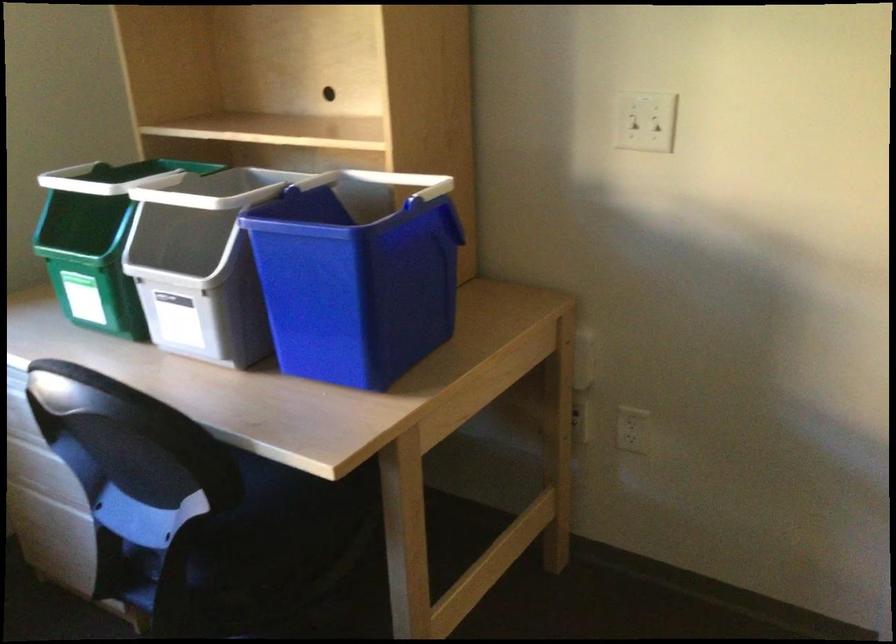
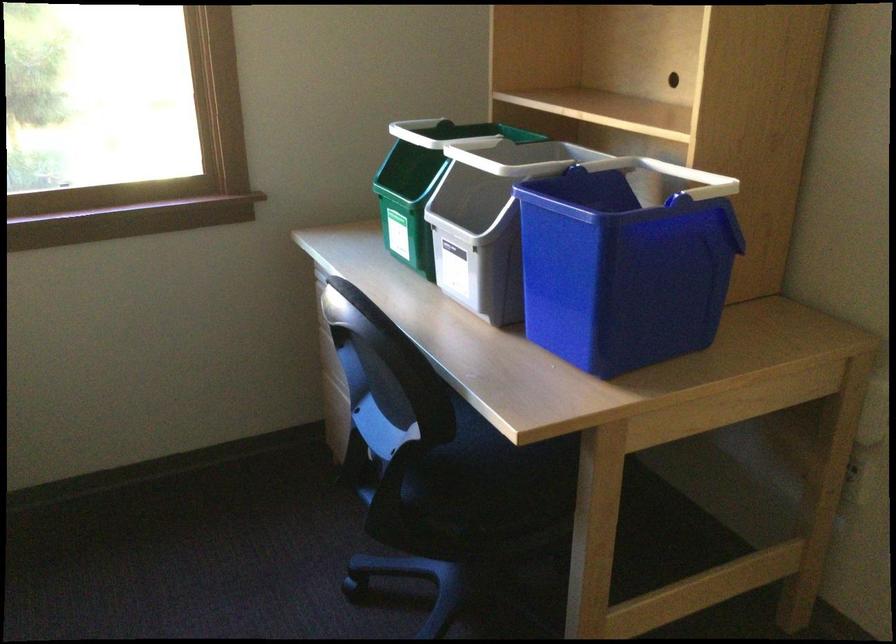
Where in the second image is the point corresponding to pixel 266 532 from the first image?

(479, 476)